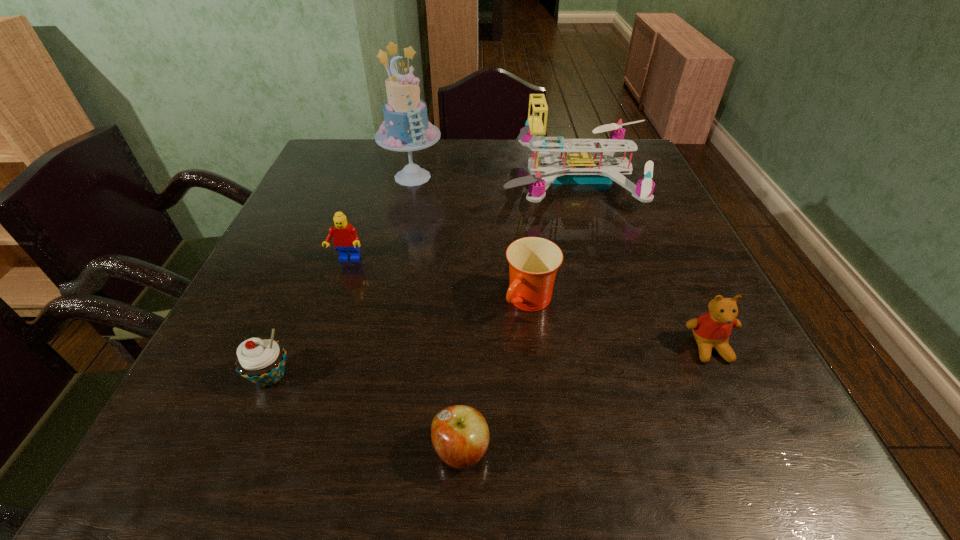
Locate an element on the screen. Lego present at the left edge is located at coordinates (345, 238).

Locate an element on the screen. The width and height of the screenshot is (960, 540). cupcake present at the left edge is located at coordinates click(261, 361).

Image resolution: width=960 pixels, height=540 pixels. In order to click on drone located in the right edge section of the desktop in this screenshot , I will do `click(579, 167)`.

This screenshot has width=960, height=540. Identify the location of teddy bear present at the right edge. (711, 330).

I want to click on object present at the far right corner, so click(x=579, y=167).

You are a GUI agent. You are given a task and a screenshot of the screen. Output one action in this format:
    pyautogui.click(x=<x>, y=<y>)
    Task: Click on the free point at the far edge
    The height and width of the screenshot is (540, 960).
    Given the screenshot: What is the action you would take?
    pyautogui.click(x=397, y=172)

This screenshot has height=540, width=960. In the image, there is a desktop. Identify the location of vacant space at the near edge. (491, 467).

Find the location of a particular element. vacant space at the left edge is located at coordinates (305, 240).

In the image, there is a desktop. Find the location of `free space at the right edge`. free space at the right edge is located at coordinates (x=643, y=234).

At what (x,y) coordinates should I click in order to perform the action: click on vacant space at the far left corner of the desktop. Please return your answer as a coordinate pair (x, y). Looking at the image, I should click on (352, 171).